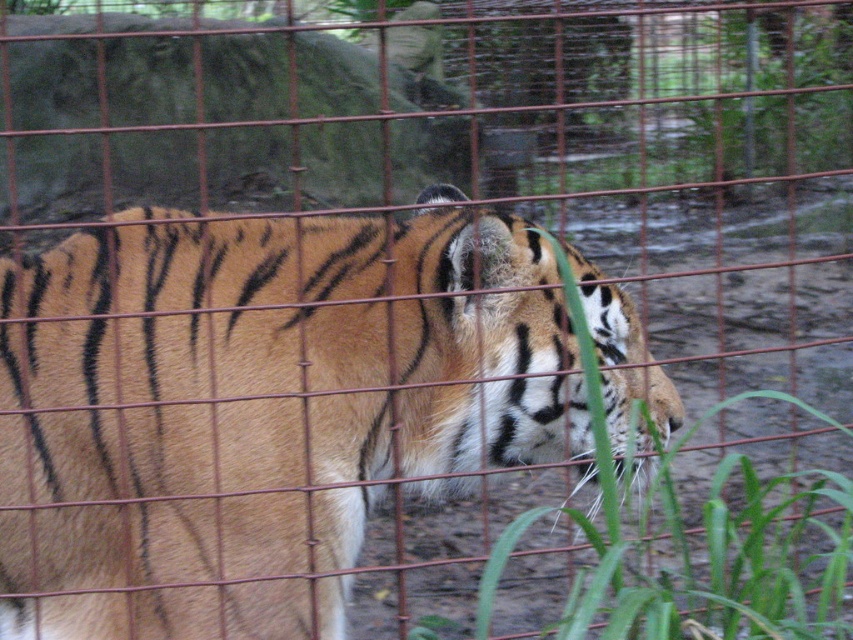
Looking at this image, can you confirm if orange fur tiger at center is bigger than green leafy grass at lower right?

Actually, orange fur tiger at center might be smaller than green leafy grass at lower right.

Is orange fur tiger at center taller than green leafy grass at lower right?

Yes, orange fur tiger at center is taller than green leafy grass at lower right.

What are the coordinates of `orange fur tiger at center` in the screenshot? It's located at (256, 410).

The image size is (853, 640). In order to click on orange fur tiger at center in this screenshot , I will do `click(256, 410)`.